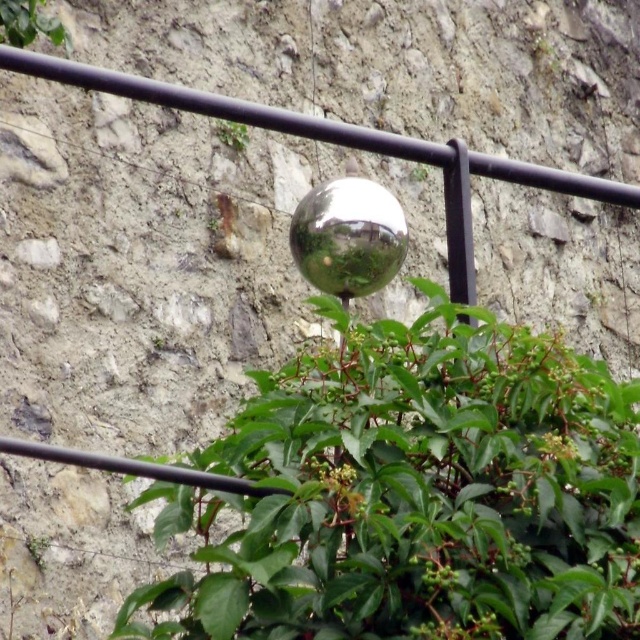
Which is above, shiny metallic sphere at center or green leafy plant at upper center?

green leafy plant at upper center is higher up.

Is shiny metallic sphere at center to the right of green leafy plant at upper center from the viewer's perspective?

Correct, you'll find shiny metallic sphere at center to the right of green leafy plant at upper center.

Who is more distant from viewer, [328,202] or [241,150]?

Point [241,150]

Where is `shiny metallic sphere at center`? The height and width of the screenshot is (640, 640). shiny metallic sphere at center is located at coordinates 348,236.

Does green leafy plant at upper left have a lesser height compared to green leafy plant at lower left?

No, green leafy plant at upper left is not shorter than green leafy plant at lower left.

Can you confirm if green leafy plant at upper left is positioned to the right of green leafy plant at lower left?

Incorrect, green leafy plant at upper left is not on the right side of green leafy plant at lower left.

Is point (1, 29) more distant than point (35, 563)?

Yes, it is.

This screenshot has height=640, width=640. I want to click on green leafy plant at upper left, so click(x=28, y=22).

Between point (326, 609) and point (332, 193), which one is positioned behind?

The point (332, 193) is more distant.

Is point (460, 595) positioned behind point (369, 237)?

No.

You are a GUI agent. You are given a task and a screenshot of the screen. Output one action in this format:
    pyautogui.click(x=<x>, y=<y>)
    Task: Click on the green leafy bush at center
    
    Given the screenshot: What is the action you would take?
    pyautogui.click(x=417, y=493)